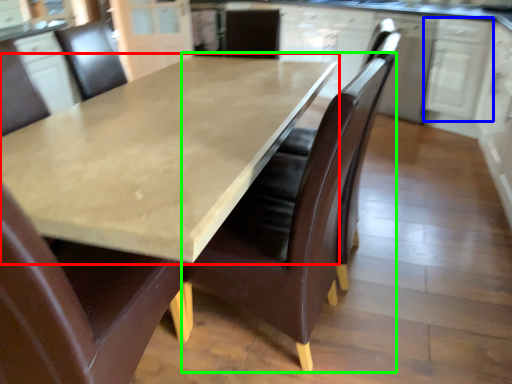
Question: Considering the real-world distances, which object is closest to countertop (highlighted by a red box)? cabinetry (highlighted by a blue box) or chair (highlighted by a green box).

Choices:
 (A) cabinetry
 (B) chair

Answer: (B)